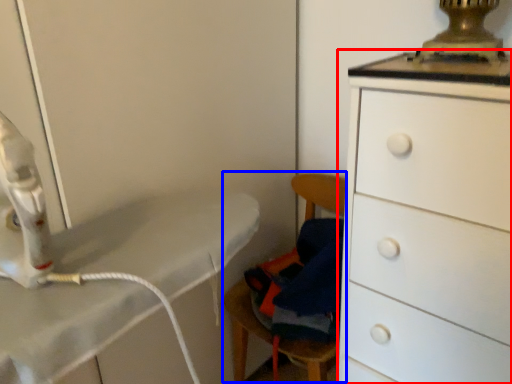
Question: Which object appears farthest to the camera in this image, chest of drawers (highlighted by a red box) or swivel chair (highlighted by a blue box)?

Choices:
 (A) chest of drawers
 (B) swivel chair

Answer: (B)